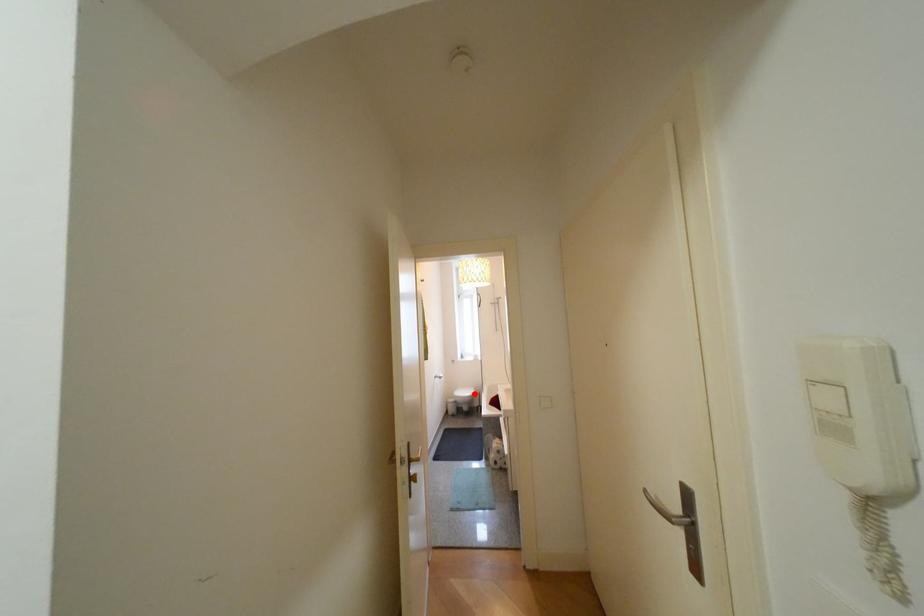
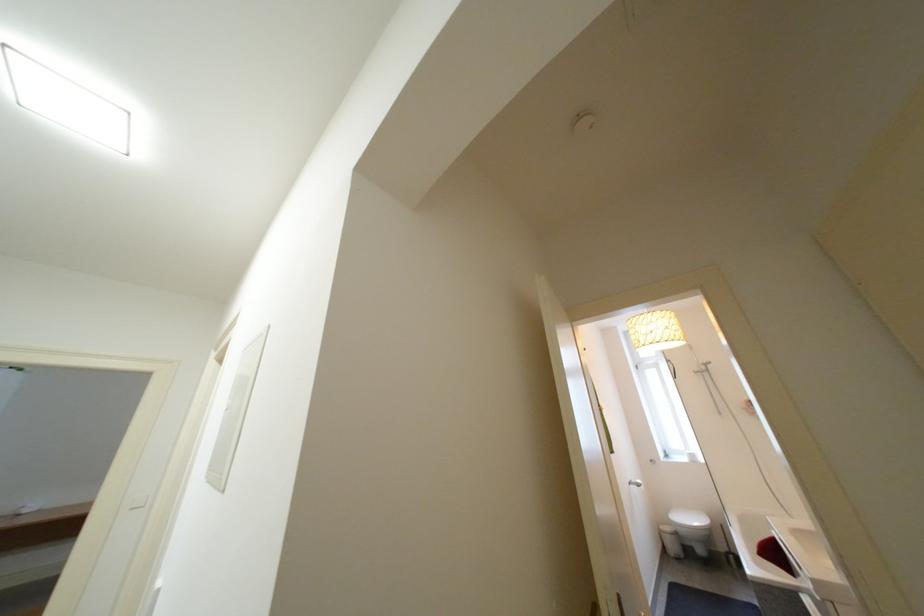
Question: A red point is marked in image1. In image2, is the corresponding 3D point closer to the camera or farther? Reply with the corresponding letter.

Choices:
 (A) The corresponding 3D point is closer.
 (B) The corresponding 3D point is farther.

Answer: (A)